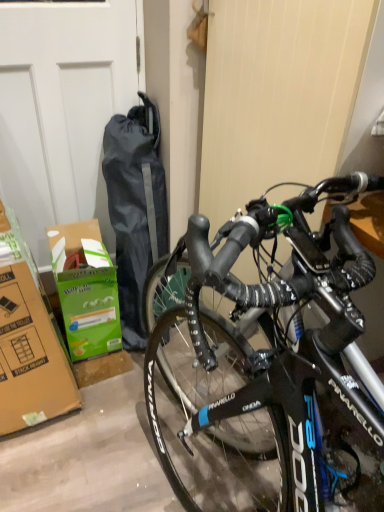
This screenshot has width=384, height=512. What do you see at coordinates (86, 290) in the screenshot? I see `green cardboard box at lower left` at bounding box center [86, 290].

You are a GUI agent. You are given a task and a screenshot of the screen. Output one action in this format:
    pyautogui.click(x=<x>, y=<y>)
    Task: Click on the green cardboard box at lower left
    This screenshot has width=384, height=512.
    Given the screenshot: What is the action you would take?
    pyautogui.click(x=86, y=290)

Describe the element at coordinates (61, 109) in the screenshot. This screenshot has width=384, height=512. I see `white matte garage door at upper left` at that location.

Find the location of a particular element. white matte garage door at upper left is located at coordinates (61, 109).

What is the approximate width of white matte garage door at upper left?

white matte garage door at upper left is 3.44 inches in width.

The width and height of the screenshot is (384, 512). What are the coordinates of `green cardboard box at lower left` in the screenshot? It's located at (86, 290).

Considering the positions of objects white matte garage door at upper left and green cardboard box at lower left in the image provided, who is more to the left, white matte garage door at upper left or green cardboard box at lower left?

From the viewer's perspective, white matte garage door at upper left appears more on the left side.

Which object is closer to the camera, white matte garage door at upper left or green cardboard box at lower left?

white matte garage door at upper left is in front.

Which is nearer, (2,110) or (105,312)?

Point (2,110) is positioned closer to the camera compared to point (105,312).

From the image's perspective, is white matte garage door at upper left above or below green cardboard box at lower left?

white matte garage door at upper left is above green cardboard box at lower left.

From a real-world perspective, which object rests below the other?

In real-world perspective, green cardboard box at lower left is lower.

Which of these two, white matte garage door at upper left or green cardboard box at lower left, is wider?

Wider between the two is green cardboard box at lower left.

Is white matte garage door at upper left shorter than green cardboard box at lower left?

No.

Based on the photo, can you confirm if white matte garage door at upper left is smaller than green cardboard box at lower left?

Actually, white matte garage door at upper left might be larger than green cardboard box at lower left.

Would you say white matte garage door at upper left contains green cardboard box at lower left?

Actually, green cardboard box at lower left is outside white matte garage door at upper left.

Can you see white matte garage door at upper left touching green cardboard box at lower left?

No, white matte garage door at upper left is not with green cardboard box at lower left.

Does white matte garage door at upper left turn towards green cardboard box at lower left?

Yes, white matte garage door at upper left is aimed at green cardboard box at lower left.

Can you tell me how much white matte garage door at upper left and green cardboard box at lower left differ in facing direction?

There is a 0.266-degree angle between the facing directions of white matte garage door at upper left and green cardboard box at lower left.

This screenshot has height=512, width=384. In order to click on cardboard box behind the white matte garage door at upper left in this screenshot , I will do `click(86, 290)`.

In the scene shown: Is green cardboard box at lower left to the left of white matte garage door at upper left from the viewer's perspective?

Incorrect, green cardboard box at lower left is not on the left side of white matte garage door at upper left.

Considering the positions of objects green cardboard box at lower left and white matte garage door at upper left in the image provided, who is behind, green cardboard box at lower left or white matte garage door at upper left?

green cardboard box at lower left is further from the camera.

Is point (75, 301) positioned before point (92, 93)?

No, it is not.

From the image's perspective, is green cardboard box at lower left positioned above or below white matte garage door at upper left?

From the image's perspective, green cardboard box at lower left appears below white matte garage door at upper left.

From a real-world perspective, is green cardboard box at lower left physically above white matte garage door at upper left?

Incorrect, from a real-world perspective, green cardboard box at lower left is lower than white matte garage door at upper left.

Can you confirm if green cardboard box at lower left is thinner than white matte garage door at upper left?

No, green cardboard box at lower left is not thinner than white matte garage door at upper left.

Based on the photo, from their relative heights in the image, would you say green cardboard box at lower left is taller or shorter than white matte garage door at upper left?

Considering their sizes, green cardboard box at lower left has less height than white matte garage door at upper left.

Does green cardboard box at lower left have a larger size compared to white matte garage door at upper left?

No, green cardboard box at lower left is not bigger than white matte garage door at upper left.

Is green cardboard box at lower left completely or partially outside of white matte garage door at upper left?

green cardboard box at lower left lies outside white matte garage door at upper left's area.

Is green cardboard box at lower left next to white matte garage door at upper left?

green cardboard box at lower left is not next to white matte garage door at upper left, and they're not touching.

Is green cardboard box at lower left oriented towards white matte garage door at upper left?

No, green cardboard box at lower left does not turn towards white matte garage door at upper left.

How many degrees apart are the facing directions of green cardboard box at lower left and white matte garage door at upper left?

They differ by 0.266 degrees in their facing directions.

You are a GUI agent. You are given a task and a screenshot of the screen. Output one action in this format:
    pyautogui.click(x=<x>, y=<y>)
    Task: Click on the cardboard box located below the white matte garage door at upper left (from the image's perspective)
    
    Given the screenshot: What is the action you would take?
    pyautogui.click(x=86, y=290)

The height and width of the screenshot is (512, 384). Find the location of `cardboard box below the white matte garage door at upper left (from the image's perspective)`. cardboard box below the white matte garage door at upper left (from the image's perspective) is located at coordinates (86, 290).

At what (x,y) coordinates should I click in order to perform the action: click on garage door that is above the green cardboard box at lower left (from a real-world perspective). Please return your answer as a coordinate pair (x, y). Image resolution: width=384 pixels, height=512 pixels. Looking at the image, I should click on (61, 109).